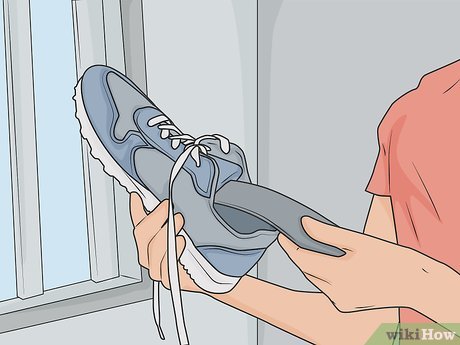
The image size is (460, 345). I want to click on window, so click(58, 220).